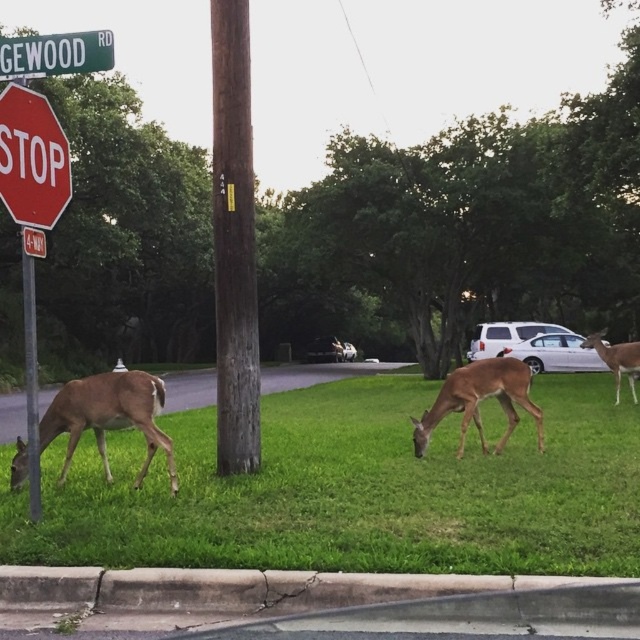
Question: Which object is the closest to the brown matte deer at left?

Choices:
 (A) red stop sign at left
 (B) white matte van at center
 (C) brown matte deer at center

Answer: (A)

Question: Where is red matte stop sign at left located in relation to brown velvet deer at right in the image?

Choices:
 (A) left
 (B) right

Answer: (A)

Question: Which is nearer to the white matte van at center?

Choices:
 (A) green metal street sign at upper left
 (B) red matte stop sign at left

Answer: (A)

Question: Which object is closer to the camera taking this photo?

Choices:
 (A) white matte van at center
 (B) brown wooden pole at center
 (C) brown velvet deer at right
 (D) brown wood pole at center

Answer: (B)

Question: Does green grass at lower left lie behind brown matte deer at center?

Choices:
 (A) no
 (B) yes

Answer: (A)

Question: Does red matte stop sign at left come behind red stop sign at left?

Choices:
 (A) yes
 (B) no

Answer: (B)